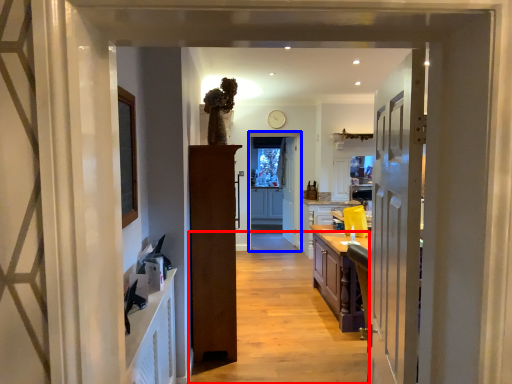
Question: Among these objects, which one is farthest to the camera, path (highlighted by a red box) or screen door (highlighted by a blue box)?

Choices:
 (A) path
 (B) screen door

Answer: (B)